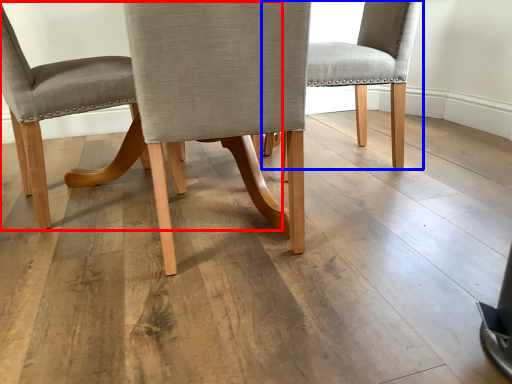
Question: Which object appears farthest to the camera in this image, chair (highlighted by a red box) or chair (highlighted by a blue box)?

Choices:
 (A) chair
 (B) chair

Answer: (B)